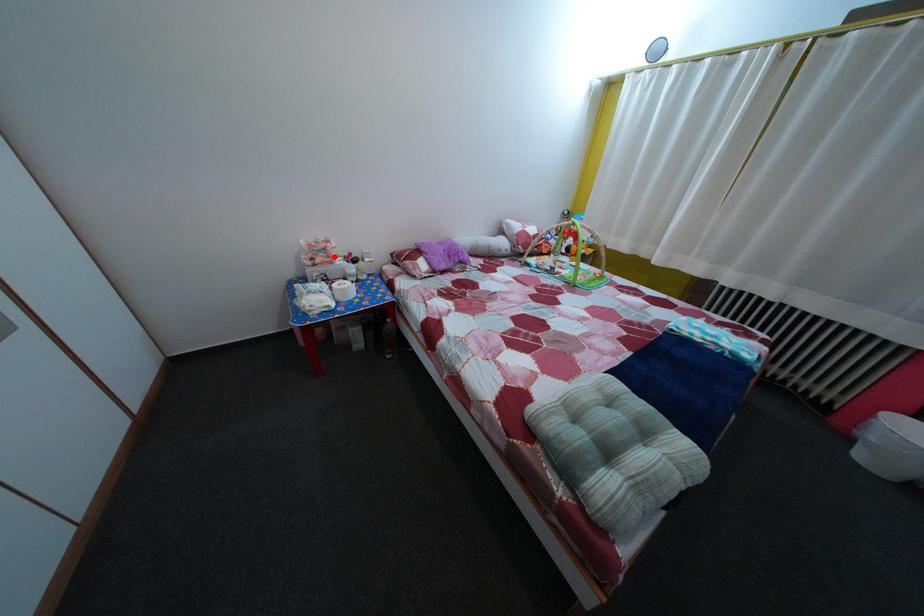
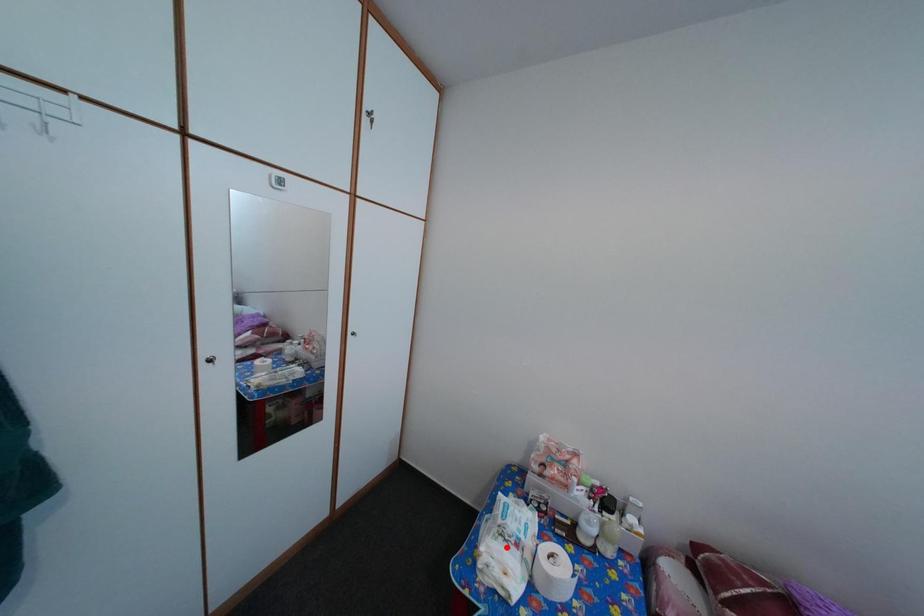
I am providing you with two images of the same scene from different viewpoints. A red point is marked on the first image and another point is marked on the second image. Is the red point in image1 aligned with the point shown in image2?

No